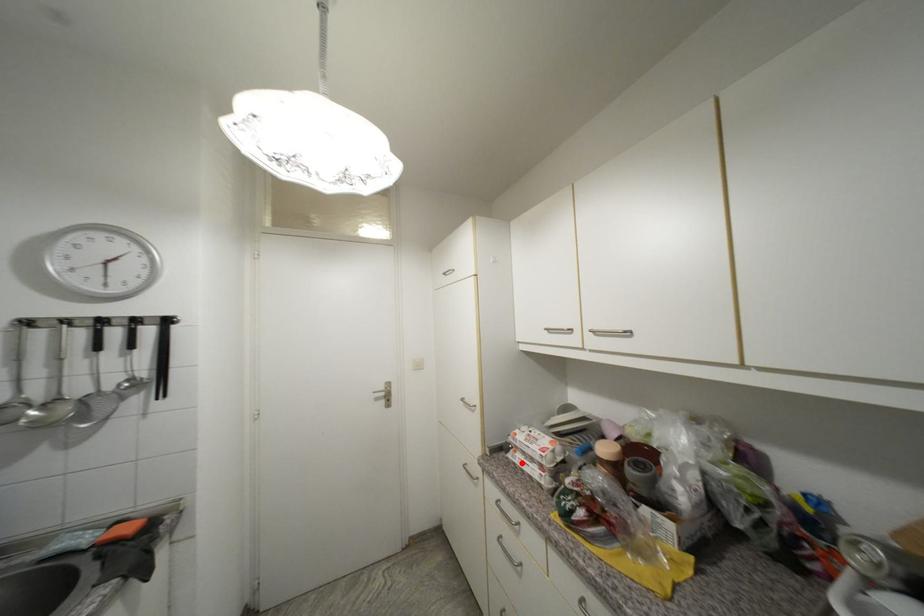
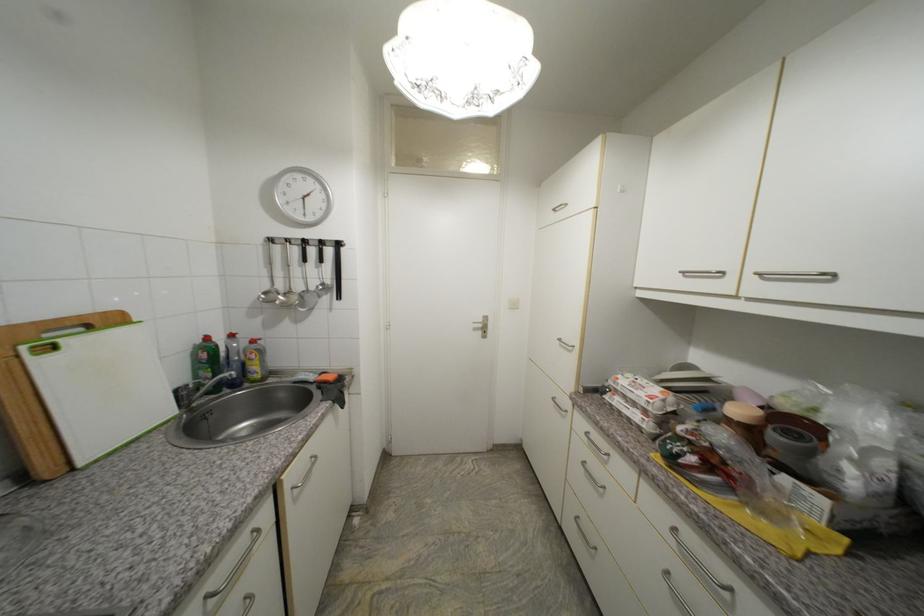
The point at the highlighted location is marked in the first image. Where is the corresponding point in the second image?

(619, 405)